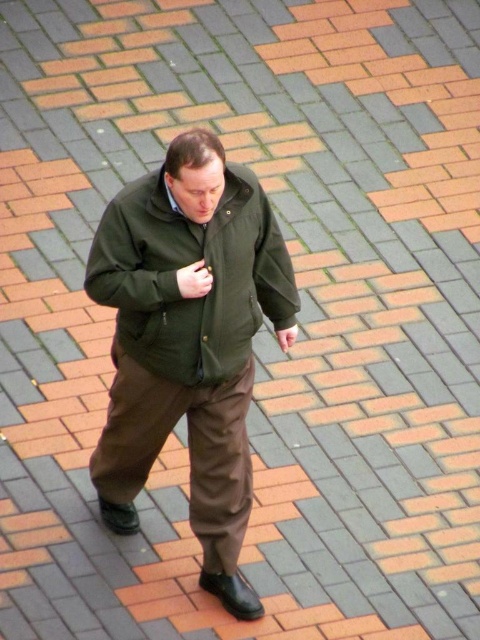
Question: Which of these objects is positioned farthest from the green matte jacket at center?

Choices:
 (A) matte khaki pants at center
 (B) olive green fabric jacket at center
 (C) matte green pocket at center

Answer: (C)

Question: Can you confirm if green matte jacket at center is wider than matte green pocket at center?

Choices:
 (A) no
 (B) yes

Answer: (B)

Question: Does green matte jacket at center have a larger size compared to matte khaki pants at center?

Choices:
 (A) yes
 (B) no

Answer: (A)

Question: Which is farther from the matte green pocket at center?

Choices:
 (A) green matte jacket at center
 (B) olive green fabric jacket at center

Answer: (A)

Question: In this image, where is matte khaki pants at center located relative to matte green pocket at center?

Choices:
 (A) above
 (B) below

Answer: (B)

Question: Estimate the real-world distances between objects in this image. Which object is closer to the matte khaki pants at center?

Choices:
 (A) green matte jacket at center
 (B) olive green fabric jacket at center
 (C) matte green pocket at center

Answer: (A)